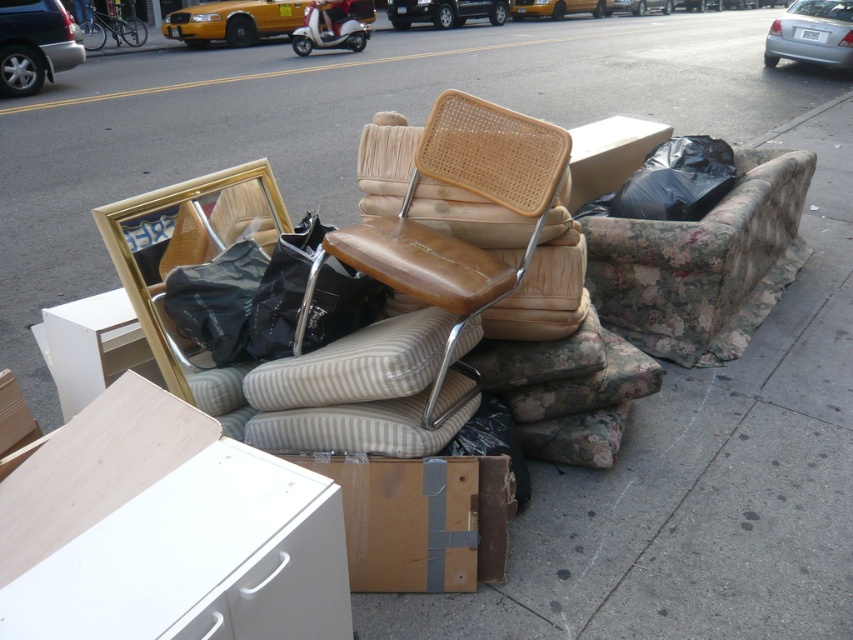
Question: Which of the following is the farthest from the observer?

Choices:
 (A) floral fabric couch at center
 (B) brown leather swivel chair at center

Answer: (A)

Question: Observing the image, what is the correct spatial positioning of brown leather swivel chair at center in reference to brown cardboard box at lower center?

Choices:
 (A) right
 (B) left

Answer: (A)

Question: Can you confirm if floral fabric couch at center is wider than brown cardboard box at lower center?

Choices:
 (A) no
 (B) yes

Answer: (B)

Question: Which point is farther to the camera?

Choices:
 (A) floral fabric couch at center
 (B) brown leather swivel chair at center

Answer: (A)

Question: Does brown leather swivel chair at center appear over brown cardboard box at lower center?

Choices:
 (A) yes
 (B) no

Answer: (A)

Question: Which object appears farthest from the camera in this image?

Choices:
 (A) black plastic bag at upper right
 (B) brown cardboard box at lower center
 (C) brown leather swivel chair at center
 (D) floral fabric couch at center

Answer: (A)